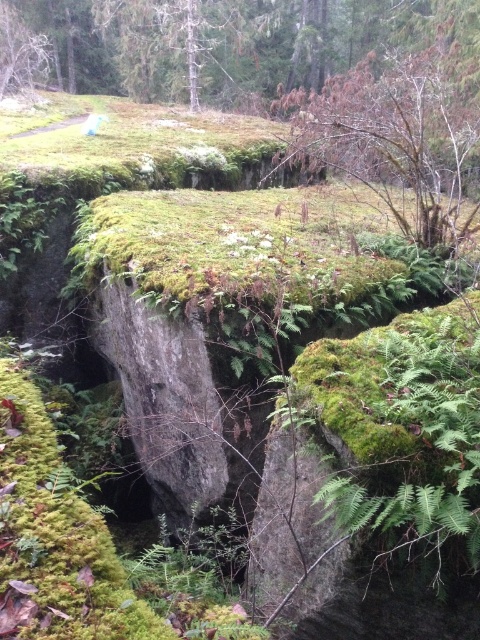
Between brown/dry wood at upper center and brown wood tree at upper left, which one appears on the left side from the viewer's perspective?

Positioned to the left is brown wood tree at upper left.

Can you confirm if brown/dry wood at upper center is positioned above brown wood tree at upper left?

No.

Which is behind, point (444, 228) or point (8, 54)?

The point (8, 54) is more distant.

This screenshot has height=640, width=480. I want to click on brown/dry wood at upper center, so click(x=396, y=138).